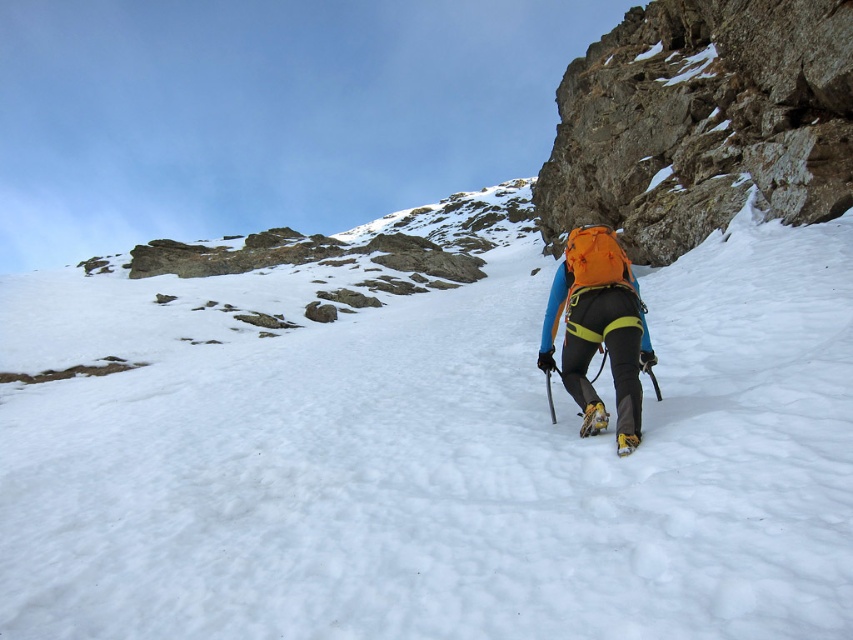
You are a drone operator tasked with capturing aerial footage of the snow and backpack in the mountain scene. Your drone has a maximum operational range of 50 meters. Can the drone safely film both the white fluffy snow at center and the orange fabric backpack at center without exceeding its range?

The white fluffy snow at center and orange fabric backpack at center are 58.15 meters apart from each other. Since the drone has a maximum range of 50 meters, it cannot safely film both without exceeding its operational limit.

You are a mountain rescue team member who needs to locate a missing climber. You have a drone with a camera that can capture a 100 feet radius. You see the white fluffy snow at center and the yellow rubber ski at lower center. Can your drone capture both objects in a single photo?

The white fluffy snow at center and yellow rubber ski at lower center are 283.91 feet apart from each other. Since the drone can only capture a 100 feet radius, it cannot capture both objects in a single photo as the distance between them exceeds the drone camera range.

You are a photographer planning to take a picture of the orange fabric backpack at center and the yellow rubber ski at lower center. Which object should you focus on first if you want to capture both in the frame without moving the camera?

The orange fabric backpack at center is larger in size than the yellow rubber ski at lower center, so you should focus on the orange fabric backpack at center first to ensure it fits well in the frame before adjusting for the smaller ski.